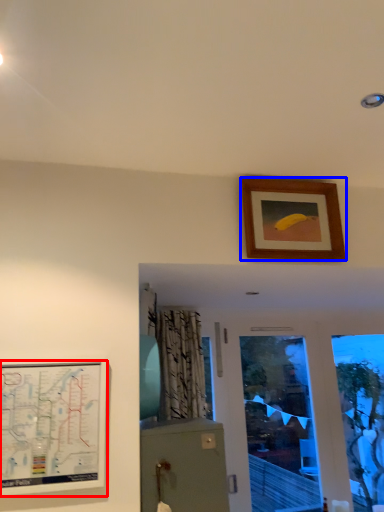
Question: Which point is closer to the camera, picture frame (highlighted by a red box) or picture frame (highlighted by a blue box)?

Choices:
 (A) picture frame
 (B) picture frame

Answer: (A)